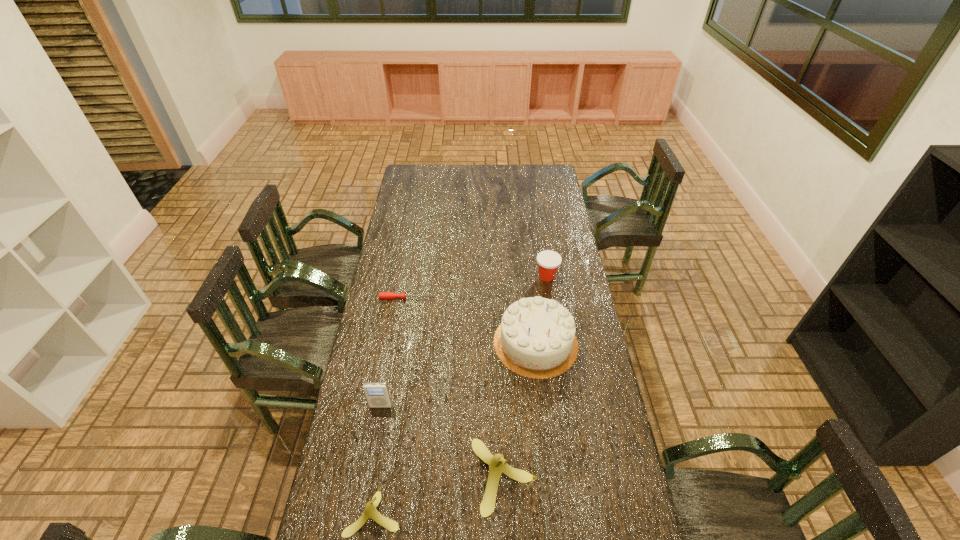
Given the evenly spaced bananas in the image, where should an extra banana be added on the right to preserve the spacing? Please point to a vacant space. Please provide its 2D coordinates. Your answer should be formatted as a tuple, i.e. [(x, y)], where the tuple contains the x and y coordinates of a point satisfying the conditions above.

[(621, 443)]